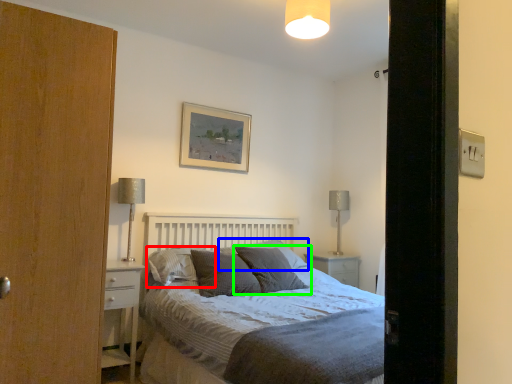
Question: Estimate the real-world distances between objects in this image. Which object is closer to pillow (highlighted by a red box), pillow (highlighted by a blue box) or pillow (highlighted by a green box)?

Choices:
 (A) pillow
 (B) pillow

Answer: (B)